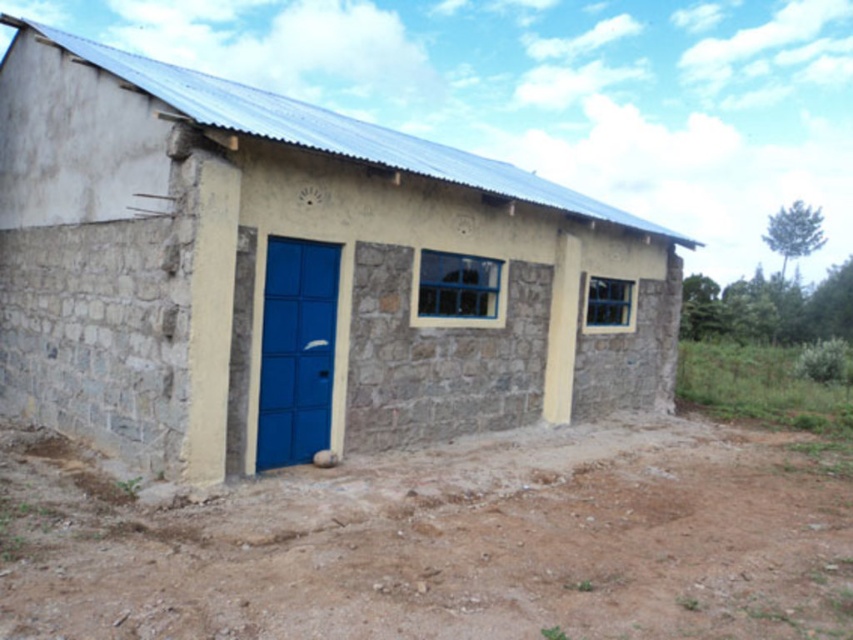
Does smooth concrete hut at center have a larger size compared to brown soil at lower center?

Yes.

Between smooth concrete hut at center and brown soil at lower center, which one has more height?

smooth concrete hut at center

Is point (223, 248) positioned before point (381, 490)?

That is True.

What are the coordinates of `smooth concrete hut at center` in the screenshot? It's located at (294, 273).

What do you see at coordinates (294, 273) in the screenshot?
I see `smooth concrete hut at center` at bounding box center [294, 273].

From the picture: Does smooth concrete hut at center have a lesser width compared to matte blue door at center left?

Incorrect, smooth concrete hut at center's width is not less than matte blue door at center left's.

Does point (120, 284) come closer to viewer compared to point (315, 289)?

That is True.

Locate an element on the screen. smooth concrete hut at center is located at coordinates (294, 273).

Who is positioned more to the right, brown soil at lower center or matte blue door at center left?

From the viewer's perspective, brown soil at lower center appears more on the right side.

Does brown soil at lower center appear over matte blue door at center left?

No.

What do you see at coordinates (444, 541) in the screenshot? I see `brown soil at lower center` at bounding box center [444, 541].

Find the location of a particular element. brown soil at lower center is located at coordinates (444, 541).